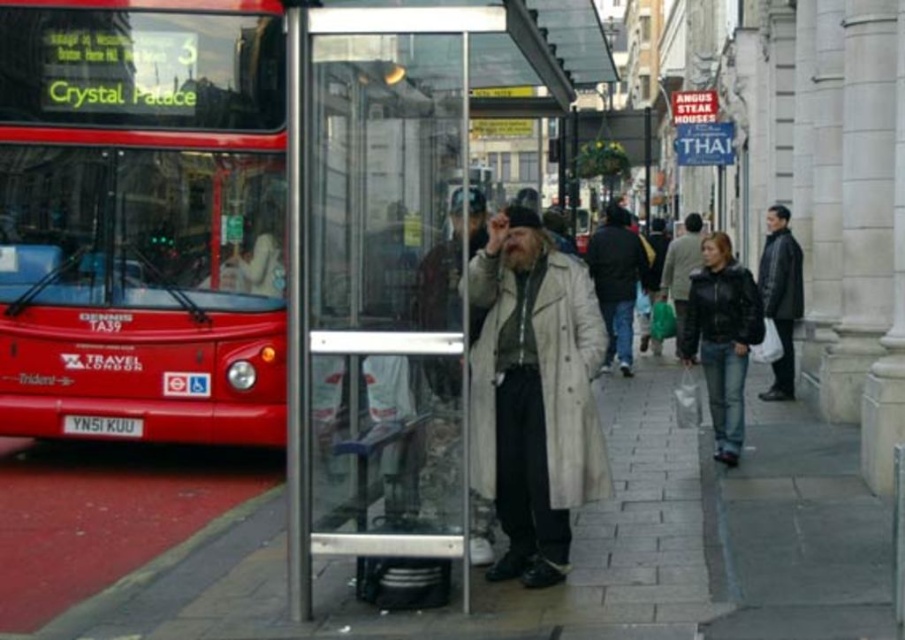
Question: Can you confirm if transparent glass bus stop at center is wider than dark brown leather jacket at right?

Choices:
 (A) yes
 (B) no

Answer: (A)

Question: Considering the real-world distances, which object is closest to the dark gray jacket at center?

Choices:
 (A) transparent glass bus stop at center
 (B) dark gray coat at center
 (C) light beige coat at center

Answer: (B)

Question: Is dark gray jacket at center bigger than dark brown leather jacket at right?

Choices:
 (A) yes
 (B) no

Answer: (A)

Question: Which point appears farthest from the camera in this image?

Choices:
 (A) (595, 273)
 (B) (344, 580)
 (C) (359, 422)
 (D) (443, 454)

Answer: (A)

Question: Can you confirm if transparent glass bus stop at center is positioned below light beige textured trench coat at center?

Choices:
 (A) yes
 (B) no

Answer: (B)

Question: Which point is farther from the camera taking this photo?

Choices:
 (A) (522, 634)
 (B) (450, 243)
 (C) (682, 314)
 (D) (618, 316)

Answer: (C)